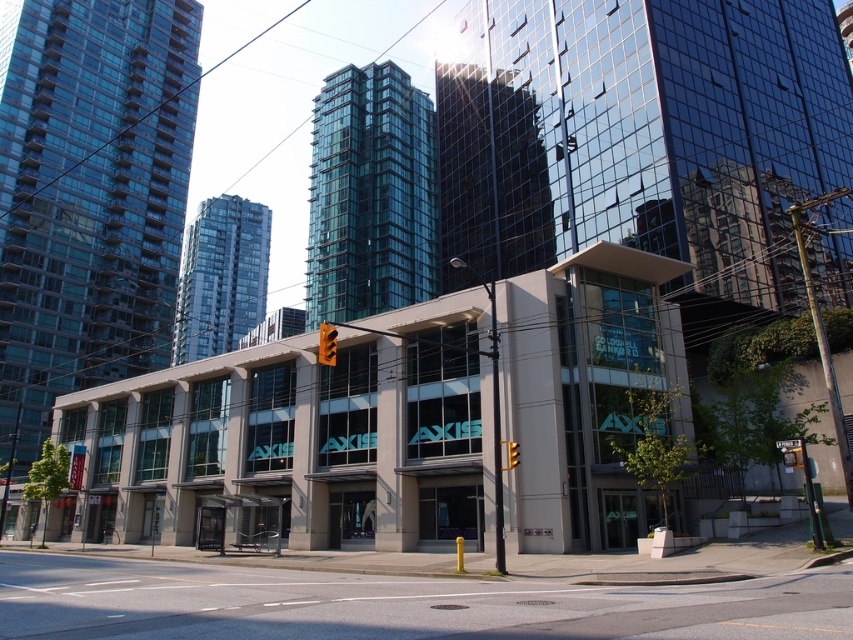
Question: Which object is positioned farthest from the concrete sidewalk at lower center?

Choices:
 (A) yellow metallic traffic light at center
 (B) orange plastic traffic light at center

Answer: (B)

Question: Is concrete sidewalk at lower center positioned in front of yellow metallic traffic light at center?

Choices:
 (A) yes
 (B) no

Answer: (A)

Question: Which point appears closest to the camera in this image?

Choices:
 (A) (506, 452)
 (B) (322, 336)
 (C) (164, 608)

Answer: (C)

Question: Observing the image, what is the correct spatial positioning of orange plastic traffic light at center in reference to yellow metallic traffic light at center?

Choices:
 (A) above
 (B) below

Answer: (A)

Question: Does concrete sidewalk at lower center appear under yellow metallic traffic light at center?

Choices:
 (A) no
 (B) yes

Answer: (B)

Question: Which is nearer to the orange plastic traffic light at center?

Choices:
 (A) yellow metallic traffic light at center
 (B) concrete sidewalk at lower center

Answer: (B)